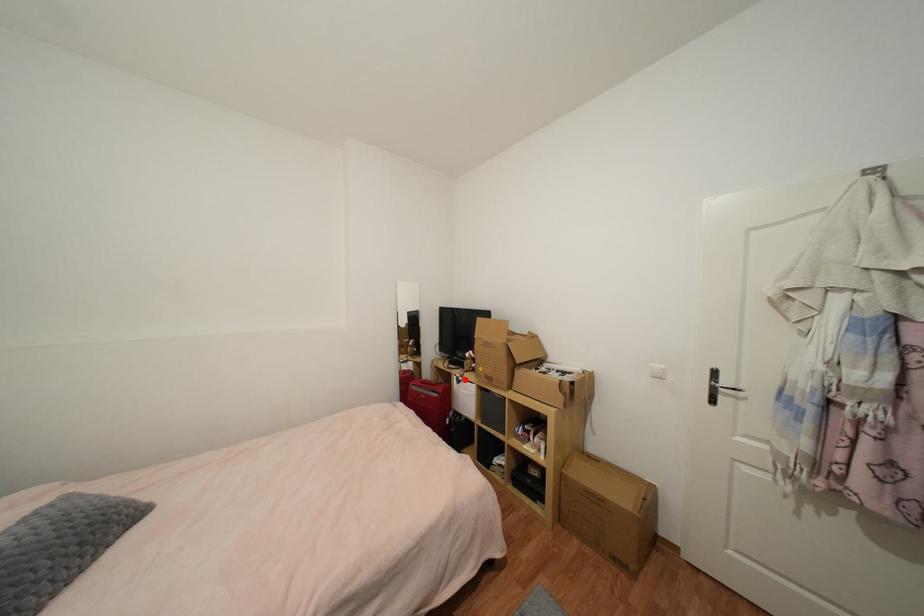
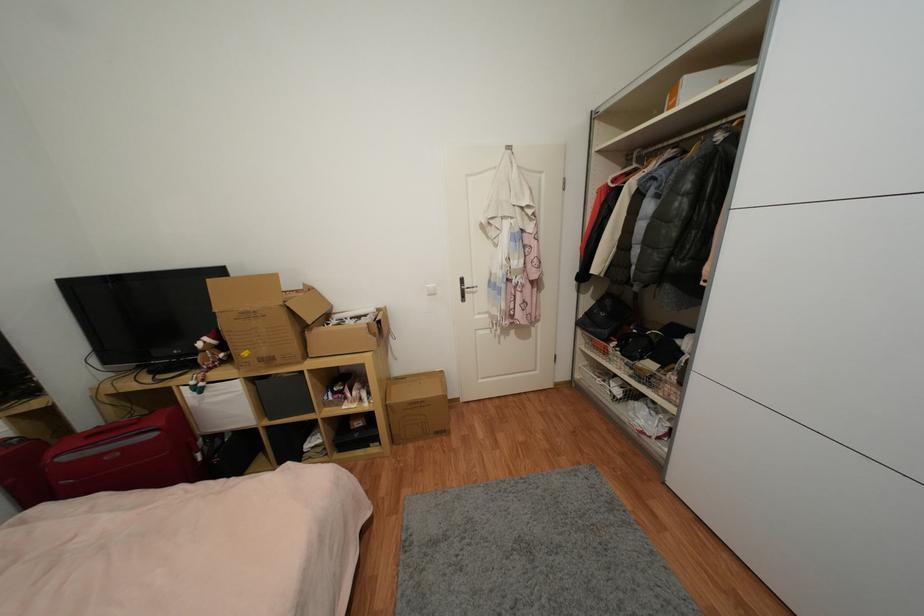
Question: I am providing you with two images of the same scene from different viewpoints. A red point is marked on the first image. Can you still see the location of the red point in image 2?

Choices:
 (A) Yes
 (B) No

Answer: (A)